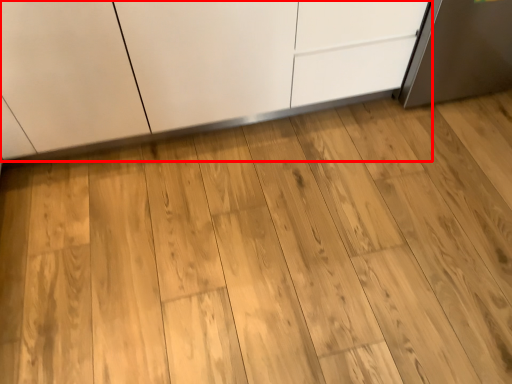
Question: Observing the image, what is the correct spatial positioning of cabinetry (annotated by the red box) in reference to dresser?

Choices:
 (A) left
 (B) right

Answer: (A)